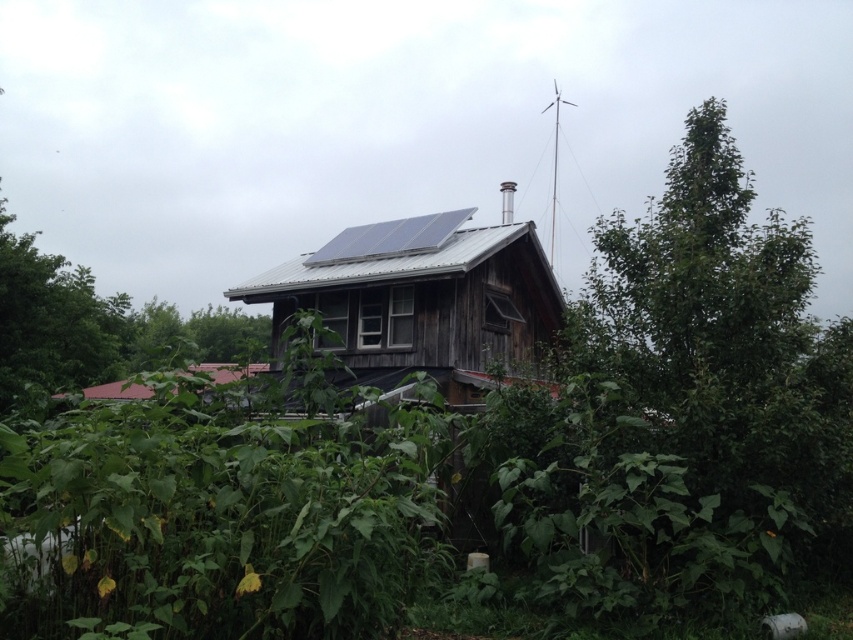
Can you confirm if metallic gray hut at center is wider than red tile roof at lower left?

Incorrect, metallic gray hut at center's width does not surpass red tile roof at lower left's.

Does point (521, 273) come in front of point (125, 390)?

Yes, it is in front of point (125, 390).

Is point (547, 305) more distant than point (209, 365)?

No, it is not.

Identify the location of metallic gray hut at center. This screenshot has height=640, width=853. (421, 300).

Can you confirm if blue metallic solar panel at upper center is positioned above red tile roof at lower left?

Correct, blue metallic solar panel at upper center is located above red tile roof at lower left.

Does point (310, 266) come behind point (140, 387)?

No, it is in front of (140, 387).

The image size is (853, 640). In order to click on blue metallic solar panel at upper center in this screenshot , I will do `click(390, 237)`.

Can you confirm if metallic gray hut at center is positioned to the right of blue metallic solar panel at upper center?

Correct, you'll find metallic gray hut at center to the right of blue metallic solar panel at upper center.

Identify the location of metallic gray hut at center. (421, 300).

The image size is (853, 640). In order to click on metallic gray hut at center in this screenshot , I will do `click(421, 300)`.